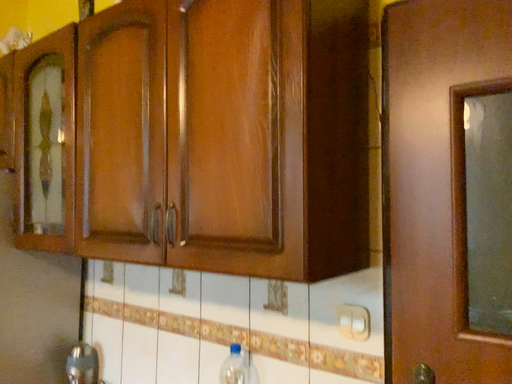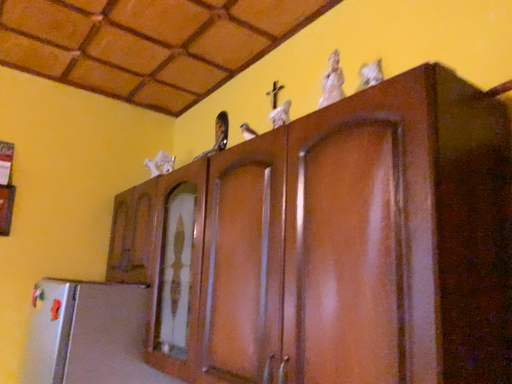
Question: Which way did the camera rotate in the video?

Choices:
 (A) rotated left
 (B) rotated right

Answer: (A)